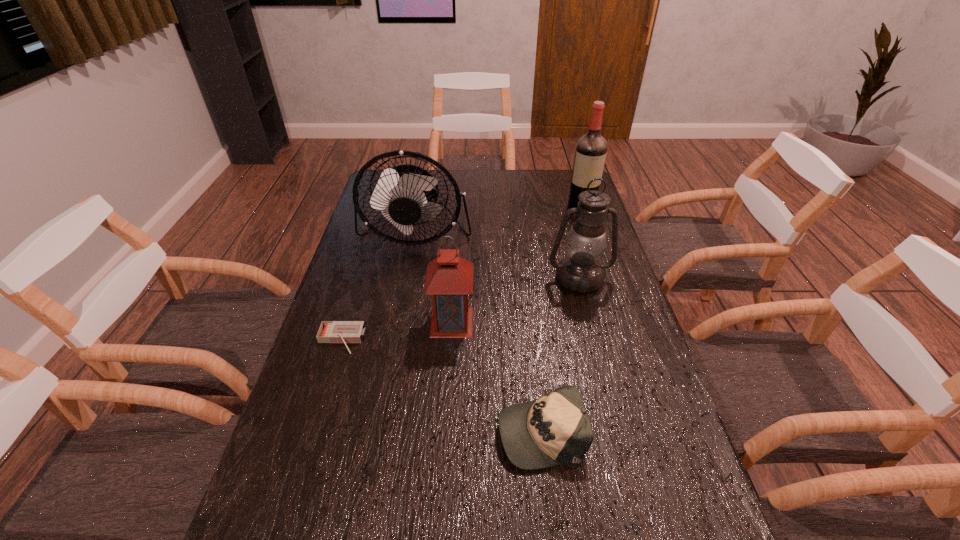
This screenshot has width=960, height=540. I want to click on vacant space located 0.050m on the left of the lantern, so click(413, 322).

The height and width of the screenshot is (540, 960). I want to click on vacant area located on the front-facing side of the baseball cap, so click(440, 431).

What are the coordinates of `vacant area situated 0.170m on the front-facing side of the baseball cap` in the screenshot? It's located at (422, 431).

Image resolution: width=960 pixels, height=540 pixels. Find the location of `vacant area situated 0.360m on the front-facing side of the baseball cap`. vacant area situated 0.360m on the front-facing side of the baseball cap is located at coordinates coord(337,431).

Identify the location of vacant region located on the striking surface of the matchbox. (295, 486).

Locate an element on the screen. The width and height of the screenshot is (960, 540). fan present at the left edge is located at coordinates (403, 194).

The height and width of the screenshot is (540, 960). I want to click on matchbox at the left edge, so click(x=345, y=332).

Identify the location of liquor present at the right edge. (590, 153).

Find the location of `oil lamp at the right edge`. oil lamp at the right edge is located at coordinates (580, 271).

Locate an element on the screen. vacant position at the far edge of the desktop is located at coordinates (523, 177).